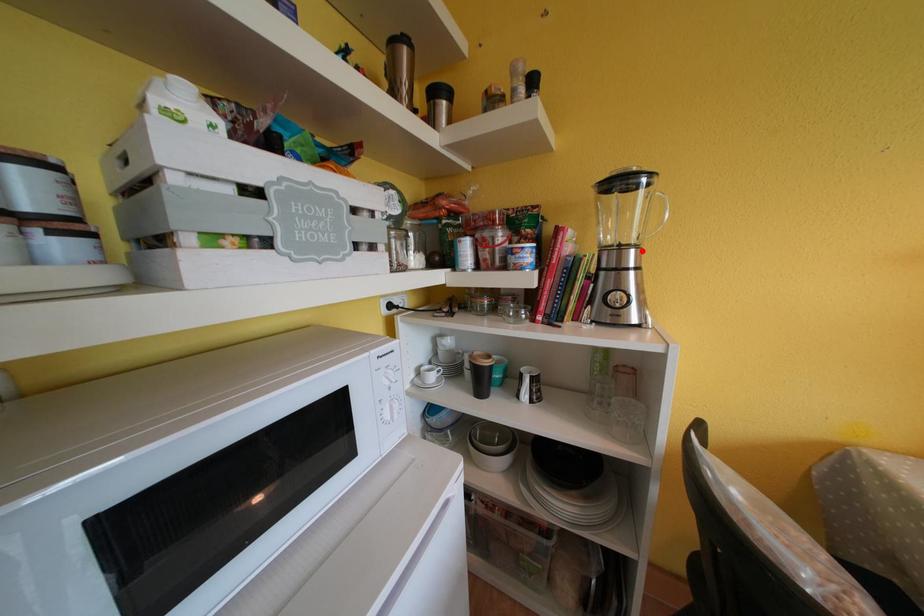
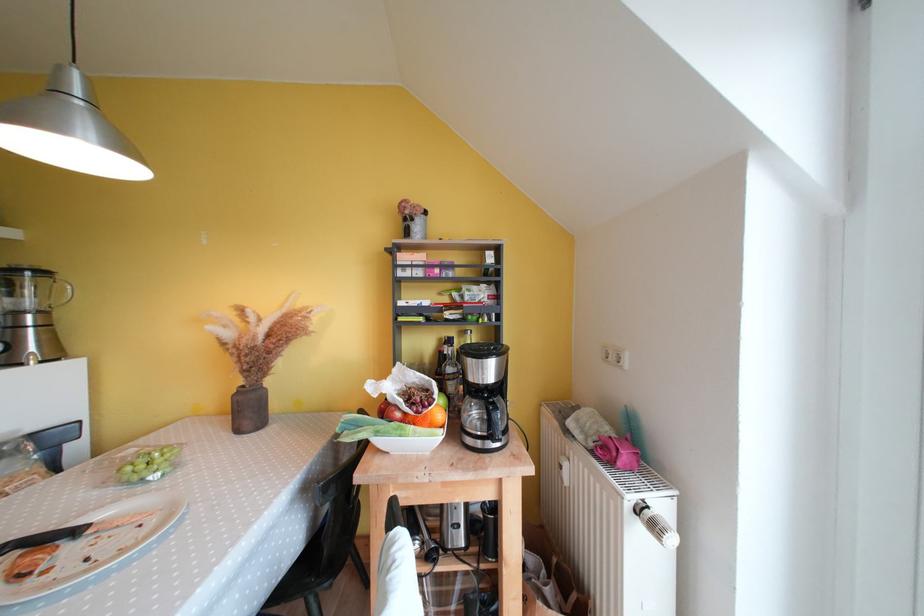
Where in the second image is the point corresponding to the highlighted location from the first image?

(49, 315)